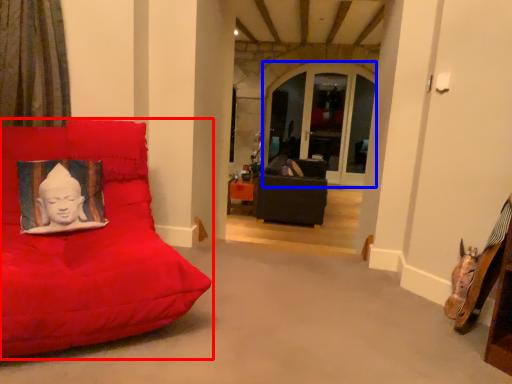
Question: Among these objects, which one is farthest to the camera, furniture (highlighted by a red box) or window (highlighted by a blue box)?

Choices:
 (A) furniture
 (B) window

Answer: (B)